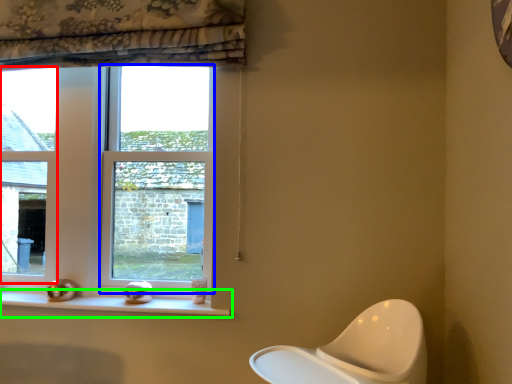
Question: Estimate the real-world distances between objects in this image. Which object is farther from window (highlighted by a red box), window (highlighted by a blue box) or window sill (highlighted by a green box)?

Choices:
 (A) window
 (B) window sill

Answer: (B)